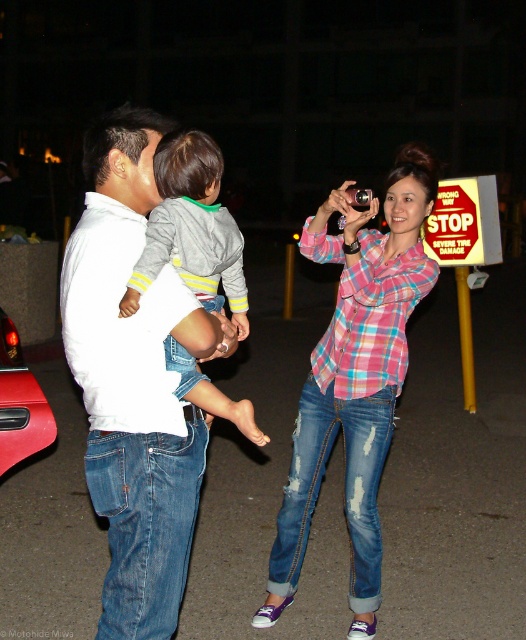
You are a photographer trying to capture a group photo of the two adults and the child. Since the white cotton shirt at center and the shiny red car at lower left are in the frame, which object should you focus on to ensure the subject is clear?

The white cotton shirt at center should be focused on because it occupies less space than the shiny red car at lower left, making it a better subject for clarity.

You are a delivery person carrying a large package and need to place it on the ground between the pink plaid shirt at center and the shiny red car at lower left. Is there enough space for the package, which is 2 meters long?

The distance between the pink plaid shirt at center and the shiny red car at lower left is 2.35 meters, so yes, the package can fit as it is shorter than the available space.

You are a pedestrian trying to cross the street safely. You see the pink plaid shirt at center and the shiny red car at lower left in your view. Which object is taller and requires more attention to avoid collision?

The pink plaid shirt at center is much taller than the shiny red car at lower left, so it requires more attention to avoid collision.